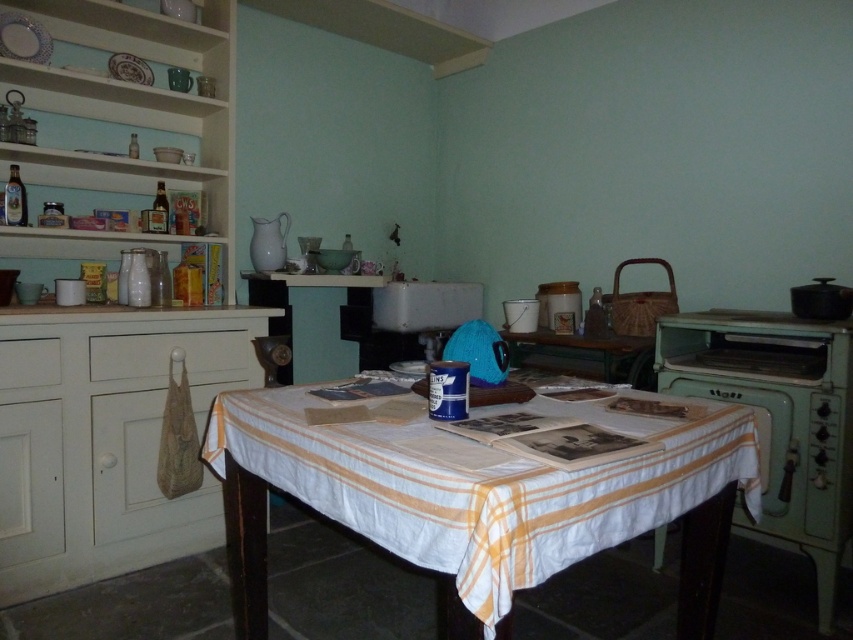
Can you confirm if wooden table at center is taller than white wood drawer at left?

Yes, wooden table at center is taller than white wood drawer at left.

Is wooden table at center further to the viewer compared to white wood drawer at left?

Yes.

Locate an element on the screen. This screenshot has width=853, height=640. wooden table at center is located at coordinates (582, 353).

Can you confirm if white striped fabric at center is bigger than green matte oven at right?

Correct, white striped fabric at center is larger in size than green matte oven at right.

Between point (289, 464) and point (769, 506), which one is positioned behind?

Positioned behind is point (769, 506).

This screenshot has height=640, width=853. What are the coordinates of `white striped fabric at center` in the screenshot? It's located at (463, 492).

Is white glossy shelves at upper left thinner than green matte oven at right?

In fact, white glossy shelves at upper left might be wider than green matte oven at right.

Which of these two, white glossy shelves at upper left or green matte oven at right, stands shorter?

green matte oven at right

Consider the image. Who is more forward, [57,44] or [821,593]?

Point [821,593] is more forward.

Find the location of a particular element. The image size is (853, 640). white glossy shelves at upper left is located at coordinates (131, 104).